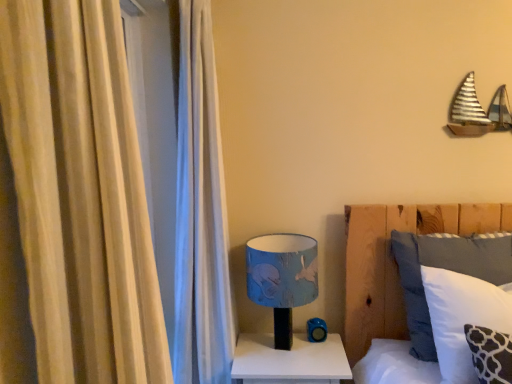
Question: Considering the relative sizes of white soft pillow at center and blue fabric lampshade at center in the image provided, is white soft pillow at center wider than blue fabric lampshade at center?

Choices:
 (A) yes
 (B) no

Answer: (B)

Question: Is white soft pillow at center positioned in front of blue fabric lampshade at center?

Choices:
 (A) yes
 (B) no

Answer: (A)

Question: Does white soft pillow at center have a greater height compared to blue fabric lampshade at center?

Choices:
 (A) yes
 (B) no

Answer: (A)

Question: Is blue fabric lampshade at center completely or partially inside white soft pillow at center?

Choices:
 (A) yes
 (B) no

Answer: (B)

Question: From a real-world perspective, is white soft pillow at center located higher than blue fabric lampshade at center?

Choices:
 (A) yes
 (B) no

Answer: (A)

Question: Does white soft pillow at center come behind blue fabric lampshade at center?

Choices:
 (A) no
 (B) yes

Answer: (A)

Question: Can you confirm if beige fabric curtain at left is wider than blue fabric lampshade at center?

Choices:
 (A) yes
 (B) no

Answer: (B)

Question: From the image's perspective, is beige fabric curtain at left located above blue fabric lampshade at center?

Choices:
 (A) yes
 (B) no

Answer: (A)

Question: Is the position of beige fabric curtain at left less distant than that of blue fabric lampshade at center?

Choices:
 (A) yes
 (B) no

Answer: (A)

Question: Does beige fabric curtain at left have a smaller size compared to blue fabric lampshade at center?

Choices:
 (A) no
 (B) yes

Answer: (A)

Question: Is blue fabric lampshade at center at the back of beige fabric curtain at left?

Choices:
 (A) yes
 (B) no

Answer: (B)

Question: From a real-world perspective, does beige fabric curtain at left sit lower than blue fabric lampshade at center?

Choices:
 (A) no
 (B) yes

Answer: (A)

Question: Considering the relative positions of white glossy nightstand at lower center and white soft pillow at center in the image provided, is white glossy nightstand at lower center to the right of white soft pillow at center from the viewer's perspective?

Choices:
 (A) yes
 (B) no

Answer: (B)